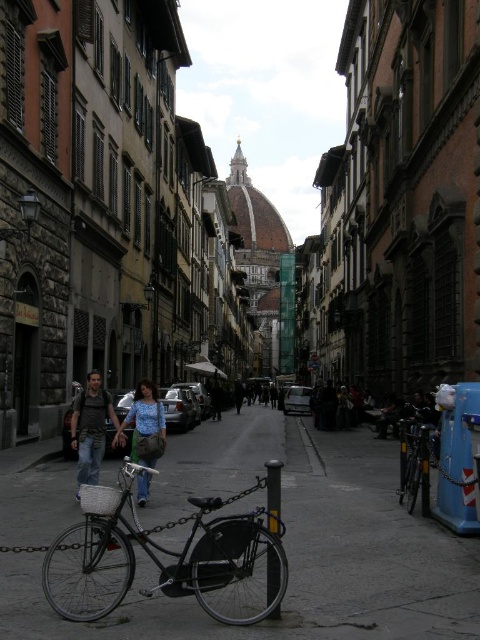
Question: Is the position of black matte bicycle at center more distant than that of denim pants at center?

Choices:
 (A) no
 (B) yes

Answer: (A)

Question: Which of the following is the farthest from the observer?

Choices:
 (A) (144, 461)
 (B) (252, 454)
 (C) (87, 454)

Answer: (B)

Question: Which object is positioned closest to the smooth concrete pavement at center?

Choices:
 (A) denim jeans at center
 (B) black matte bicycle at center
 (C) denim pants at center

Answer: (B)

Question: Which of the following is the farthest from the observer?

Choices:
 (A) (142, 492)
 (B) (103, 394)
 (C) (417, 524)

Answer: (B)

Question: Does smooth concrete pavement at center have a greater width compared to denim pants at center?

Choices:
 (A) yes
 (B) no

Answer: (A)

Question: Is black matte bicycle at center below shiny black bicycle at right?

Choices:
 (A) yes
 (B) no

Answer: (A)